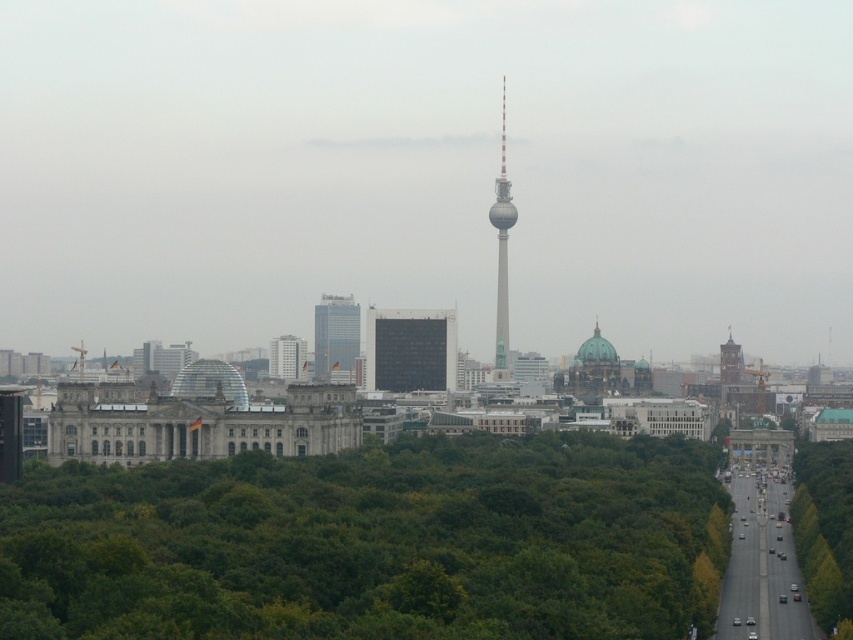
Question: Is green leafy trees at center thinner than green leafy tree at right?

Choices:
 (A) yes
 (B) no

Answer: (B)

Question: Which of the following is the farthest from the observer?

Choices:
 (A) (302, 364)
 (B) (398, 310)
 (C) (503, 163)
 (D) (343, 349)

Answer: (C)

Question: Which point appears closest to the camera in this image?

Choices:
 (A) (250, 497)
 (B) (286, 371)
 (C) (503, 296)

Answer: (C)

Question: Which of the following is the farthest from the observer?

Choices:
 (A) (505, 145)
 (B) (386, 369)
 (C) (350, 310)

Answer: (A)

Question: Can you confirm if green leafy tree at right is positioned to the right of matte glass building at center?

Choices:
 (A) yes
 (B) no

Answer: (A)

Question: In this image, where is matte glass skyscraper at center located relative to smooth gray tower at center?

Choices:
 (A) right
 (B) left

Answer: (B)